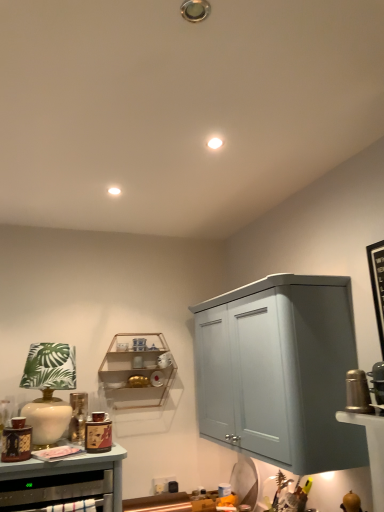
Question: Is matte brown cabinet at lower left taller or shorter than wooden shelf at center?

Choices:
 (A) short
 (B) tall

Answer: (A)

Question: From the image's perspective, relative to wooden shelf at center, is matte brown cabinet at lower left above or below?

Choices:
 (A) above
 (B) below

Answer: (B)

Question: Which object is positioned closest to the white ceramic table lamp at left?

Choices:
 (A) matte brown cabinet at lower left
 (B) wooden shelf at center

Answer: (A)

Question: Which object is the closest to the wooden shelf at center?

Choices:
 (A) white ceramic table lamp at left
 (B) matte brown cabinet at lower left

Answer: (A)